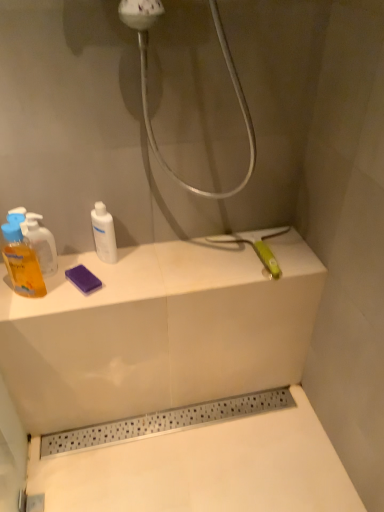
This screenshot has height=512, width=384. I want to click on vacant point to the right of white glossy bottle at center, which is counted as the 3th mouthwash, starting from the left, so click(x=158, y=263).